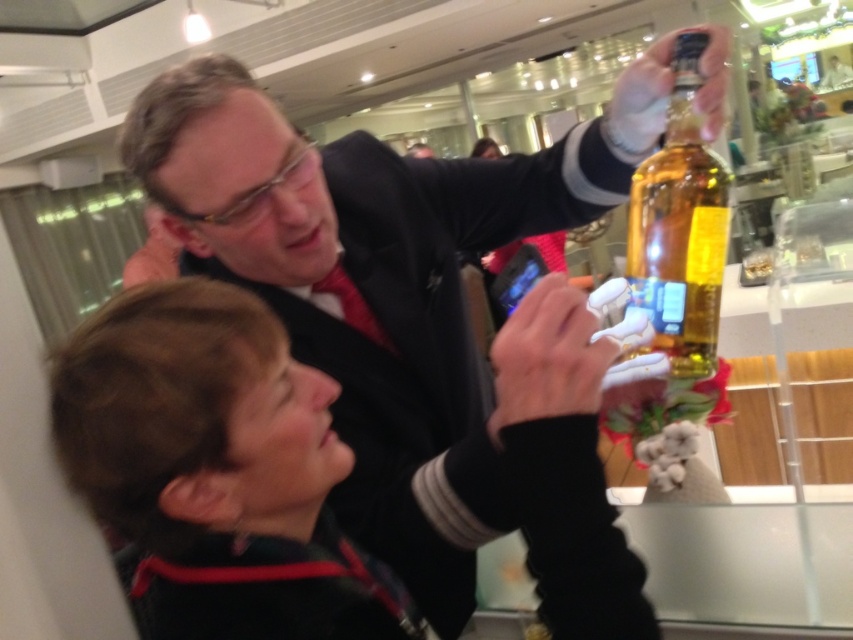
Question: Which point is closer to the camera taking this photo?

Choices:
 (A) (148, 417)
 (B) (694, 225)
 (C) (256, 227)

Answer: (A)

Question: Is the position of black fabric jacket at center more distant than that of translucent glass bottle at upper right?

Choices:
 (A) no
 (B) yes

Answer: (A)

Question: Does matte black jacket at upper center appear on the right side of black fabric jacket at center?

Choices:
 (A) yes
 (B) no

Answer: (A)

Question: Considering the real-world distances, which object is closest to the matte black jacket at upper center?

Choices:
 (A) translucent glass bottle at upper right
 (B) black fabric jacket at center

Answer: (B)

Question: Can you confirm if matte black jacket at upper center is thinner than translucent glass bottle at upper right?

Choices:
 (A) yes
 (B) no

Answer: (B)

Question: Which object appears closest to the camera in this image?

Choices:
 (A) matte black jacket at upper center
 (B) black fabric jacket at center
 (C) translucent glass bottle at upper right

Answer: (B)